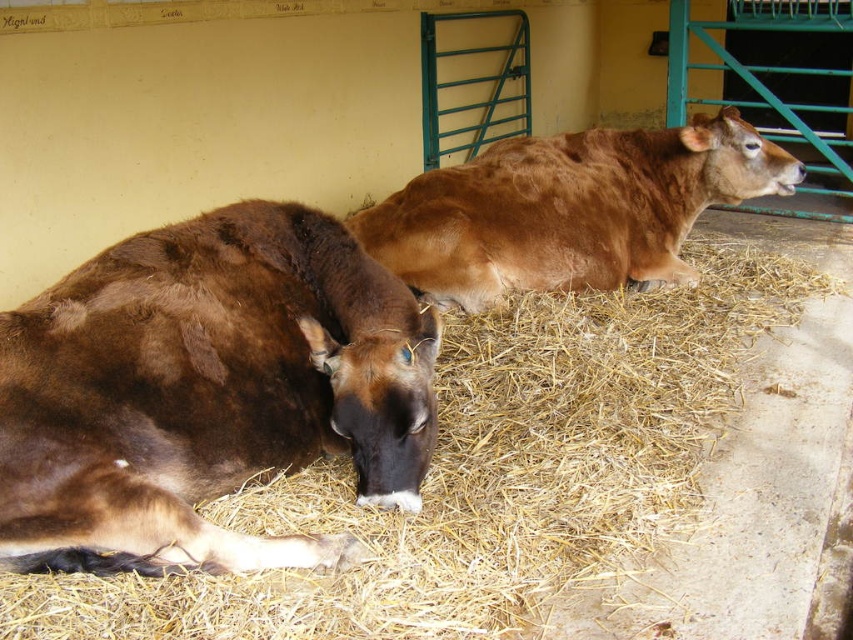
Who is more distant from viewer, [387,401] or [474,236]?

Positioned behind is point [474,236].

Can you confirm if brown matte cow at lower left is positioned to the left of brown smooth cow at center?

Indeed, brown matte cow at lower left is positioned on the left side of brown smooth cow at center.

Is point (399, 506) in front of point (506, 280)?

Yes, point (399, 506) is closer to viewer.

Locate an element on the screen. The width and height of the screenshot is (853, 640). brown matte cow at lower left is located at coordinates (206, 390).

Which is in front, point (625, 483) or point (316, 305)?

Positioned in front is point (625, 483).

Is the position of brown straw at center less distant than that of brown matte cow at lower left?

That is True.

Which is in front, point (164, 609) or point (15, 358)?

Point (164, 609)

Image resolution: width=853 pixels, height=640 pixels. What are the coordinates of `brown straw at center` in the screenshot? It's located at (490, 474).

Is brown straw at center to the left of brown smooth cow at center from the viewer's perspective?

Correct, you'll find brown straw at center to the left of brown smooth cow at center.

Which is behind, point (422, 604) or point (613, 269)?

Point (613, 269)

Describe the element at coordinates (490, 474) in the screenshot. I see `brown straw at center` at that location.

Where is `brown straw at center`? brown straw at center is located at coordinates (490, 474).